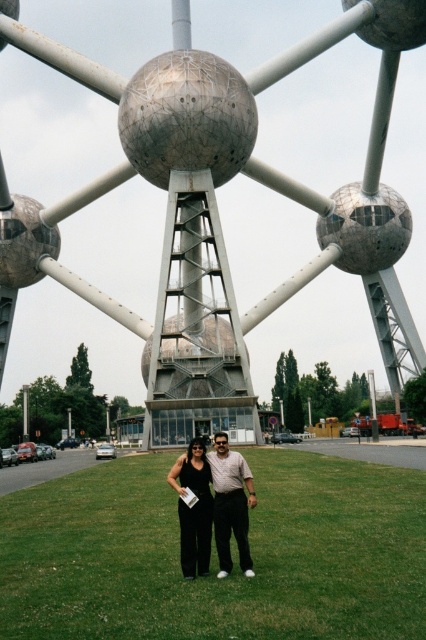
Question: Is green grass at center below black fabric couple at center?

Choices:
 (A) no
 (B) yes

Answer: (B)

Question: Which of the following is the closest to the observer?

Choices:
 (A) green grass at center
 (B) black satin dress at center
 (C) black fabric couple at center

Answer: (A)

Question: Is green grass at center wider than black fabric couple at center?

Choices:
 (A) no
 (B) yes

Answer: (B)

Question: Does black fabric couple at center have a larger size compared to black satin dress at center?

Choices:
 (A) no
 (B) yes

Answer: (B)

Question: Which is farther from the green grass at center?

Choices:
 (A) black satin dress at center
 (B) black fabric couple at center

Answer: (A)

Question: Which point is farther from the camera taking this photo?

Choices:
 (A) (273, 628)
 (B) (180, 532)

Answer: (B)